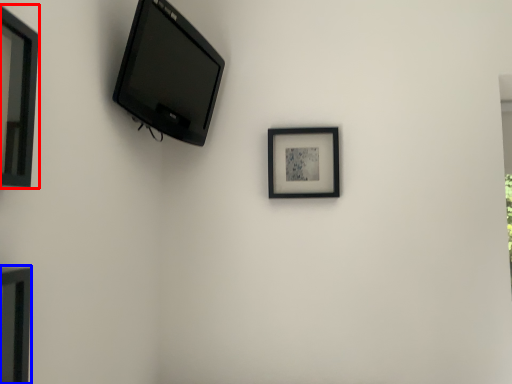
Question: Which point is closer to the camera, picture frame (highlighted by a red box) or picture frame (highlighted by a blue box)?

Choices:
 (A) picture frame
 (B) picture frame

Answer: (B)